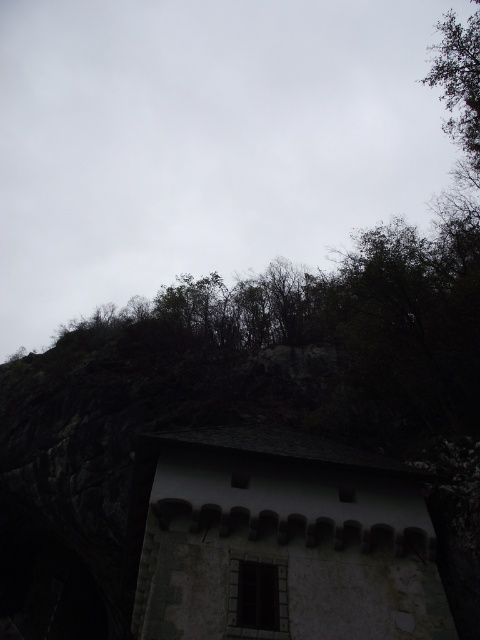
Which is more to the right, white stone hut at center or gray slate roof at upper center?

From the viewer's perspective, white stone hut at center appears more on the right side.

Does point (231, 492) come farther from viewer compared to point (424, 472)?

That is False.

This screenshot has width=480, height=640. In order to click on white stone hut at center in this screenshot , I will do `click(277, 540)`.